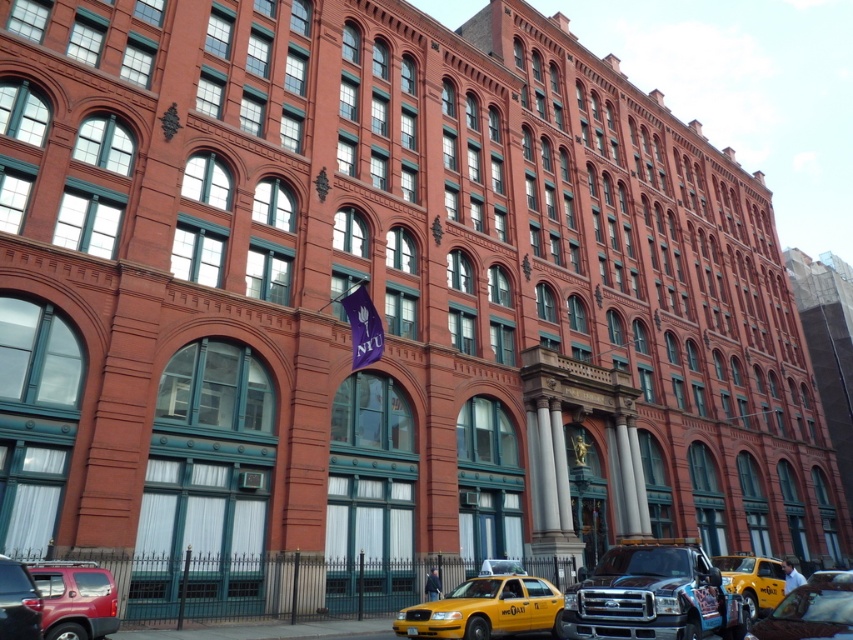
Does shiny black truck at lower right have a greater height compared to yellow matte taxi at lower right?

Correct, shiny black truck at lower right is much taller as yellow matte taxi at lower right.

The height and width of the screenshot is (640, 853). What do you see at coordinates (653, 595) in the screenshot?
I see `shiny black truck at lower right` at bounding box center [653, 595].

Who is more distant from viewer, (x=573, y=596) or (x=757, y=592)?

The point (x=757, y=592) is more distant.

You are a GUI agent. You are given a task and a screenshot of the screen. Output one action in this format:
    pyautogui.click(x=<x>, y=<y>)
    Task: Click on the shiny black truck at lower right
    The image size is (853, 640).
    Given the screenshot: What is the action you would take?
    pyautogui.click(x=653, y=595)

Is the position of yellow matte taxi at lower center more distant than that of matte red suv at lower left?

That is True.

Is yellow matte taxi at lower center to the right of matte red suv at lower left from the viewer's perspective?

Yes, yellow matte taxi at lower center is to the right of matte red suv at lower left.

This screenshot has width=853, height=640. I want to click on yellow matte taxi at lower center, so click(x=485, y=609).

Where is `yellow matte taxi at lower center`? yellow matte taxi at lower center is located at coordinates (485, 609).

Consider the image. Does yellow matte taxi at lower center appear over matte black suv at lower left?

No, yellow matte taxi at lower center is not above matte black suv at lower left.

The image size is (853, 640). I want to click on yellow matte taxi at lower center, so click(x=485, y=609).